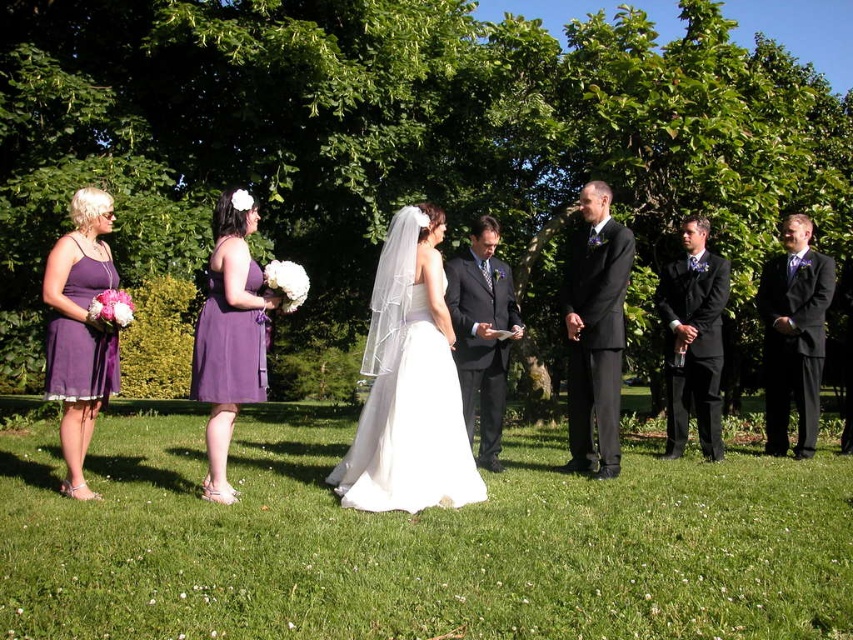
Question: Which object appears farthest from the camera in this image?

Choices:
 (A) purple chiffon dress at center
 (B) matte purple dress at left

Answer: (B)

Question: Which object is farther from the camera taking this photo?

Choices:
 (A) purple satin dresses at left
 (B) purple satin dress at left

Answer: (A)

Question: Does black suit at center appear on the right side of purple chiffon dress at center?

Choices:
 (A) no
 (B) yes

Answer: (B)

Question: Which object is closer to the camera taking this photo?

Choices:
 (A) matte purple dress at left
 (B) black satin suit at right
 (C) purple satin dresses at left
 (D) purple satin dress at left

Answer: (D)

Question: Can you confirm if dark suit at center is bigger than purple satin dress at center?

Choices:
 (A) no
 (B) yes

Answer: (B)

Question: Can you confirm if purple satin dress at left is thinner than dark suit at center?

Choices:
 (A) no
 (B) yes

Answer: (A)